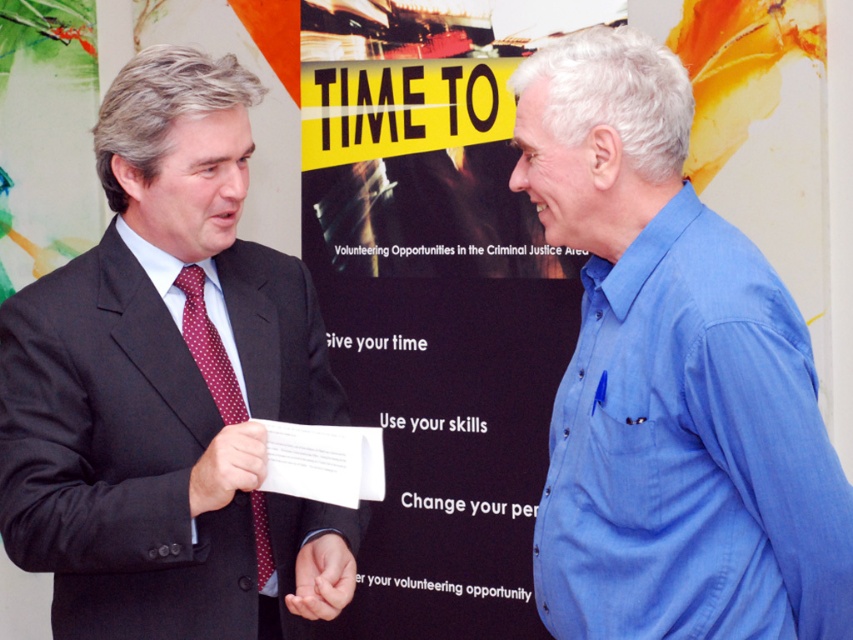
You are standing in front of the promotional poster and see the matte black suit at left. If you want to move to the right by 0.2 units in the image coordinate system, what will be your new position?

Moving to the right by 0.2 units from the current position at point (161, 378) would result in a new position at point (161, 506).

You are an artist trying to sketch this scene. You need to decide which object to draw first based on their size. According to the scene, which object should you start with, the matte red tie at center or the smooth skin hand at center?

The matte red tie at center occupies less space than the smooth skin hand at center, so you should start with the smooth skin hand at center since it is larger and might require more attention to detail first.